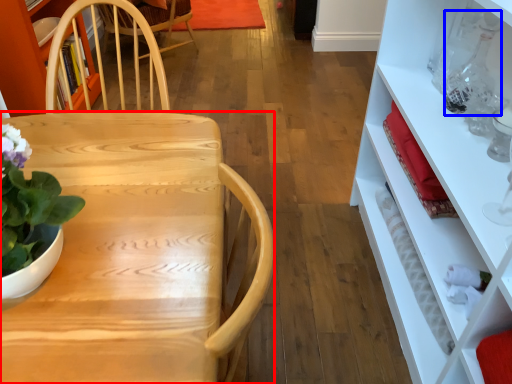
Question: Which of the following is the farthest to the observer, desk (highlighted by a red box) or bottle (highlighted by a blue box)?

Choices:
 (A) desk
 (B) bottle

Answer: (B)